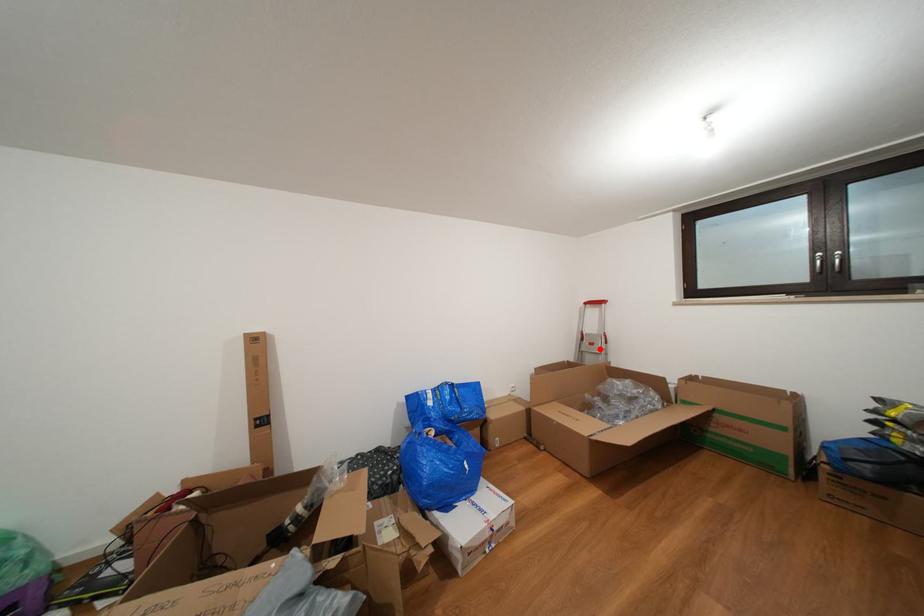
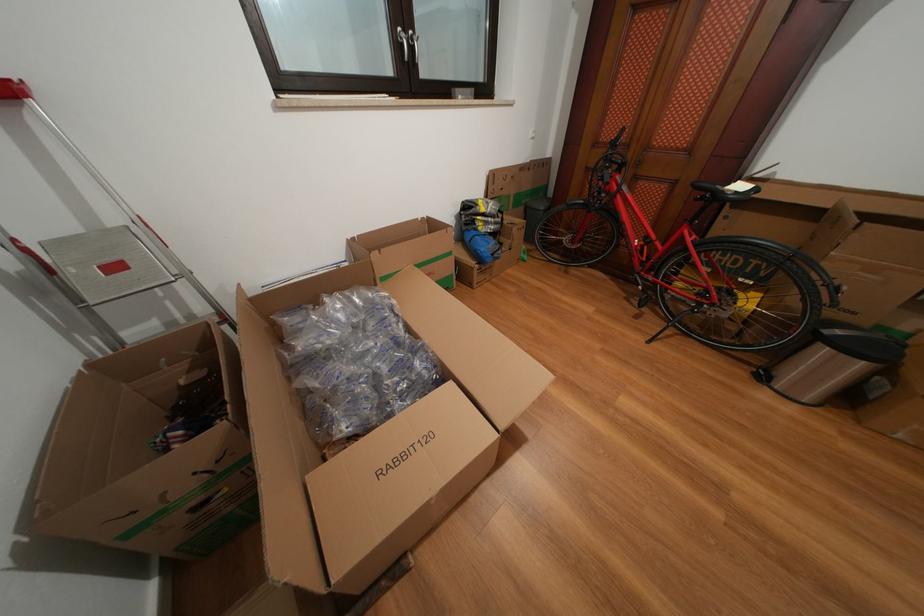
In the second image, find the point that corresponds to the highlighted location in the first image.

(124, 273)